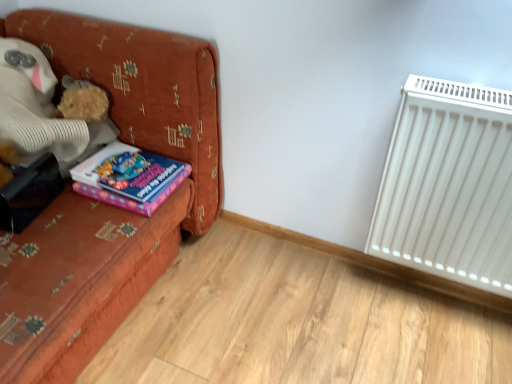
Question: Considering their positions, is purple matte book at left located in front of or behind velvet orange couch at left?

Choices:
 (A) front
 (B) behind

Answer: (B)

Question: In terms of size, does purple matte book at left appear bigger or smaller than velvet orange couch at left?

Choices:
 (A) big
 (B) small

Answer: (B)

Question: Estimate the real-world distances between objects in this image. Which object is farther from the velvet orange couch at left?

Choices:
 (A) fluffy beige teddy bear at left
 (B) white plastic radiator at right
 (C) purple matte book at left

Answer: (B)

Question: Which is nearer to the velvet orange couch at left?

Choices:
 (A) purple matte book at left
 (B) fluffy beige teddy bear at left
 (C) white plastic radiator at right

Answer: (A)